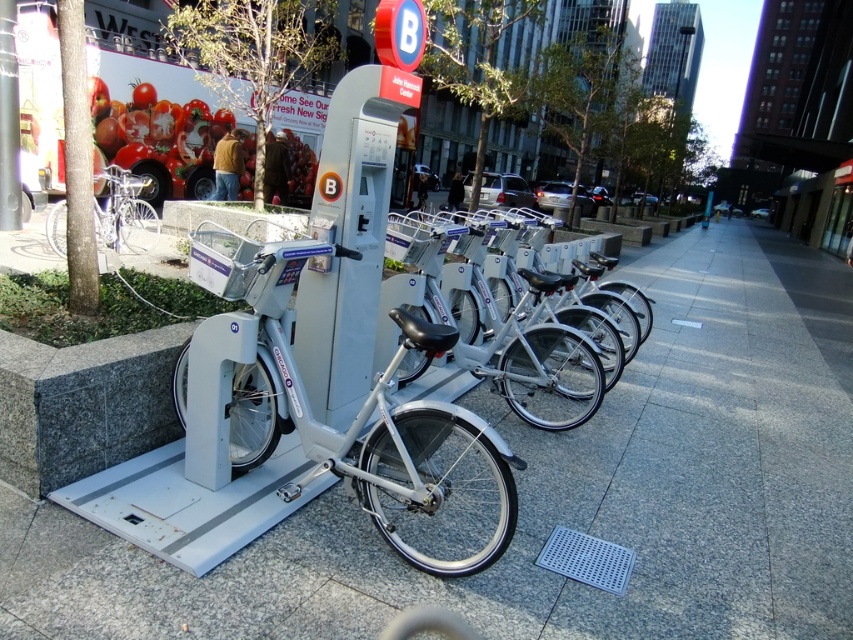
You are a delivery person who needs to park your bike at the docking station. Your bike is the same size as the silver metallic bicycle at left. The docking station has a limited space between the silver metallic pavement at center and the station itself. Can your bike fit in that space?

The silver metallic pavement at center is positioned on the right side of the silver metallic bicycle at left, meaning there is enough space between them for the bike to fit as long as it matches the bicycle at left in size.

You are a delivery person who needs to place a small package on the silver metallic pavement at center. The package is 1.2 meters wide. Can you fit the package on the pavement without overlapping the silver metallic bicycle at left?

The silver metallic pavement at center might be wider than silver metallic bicycle at left, so it is possible that the pavement can accommodate the 1.2 meter wide package without overlapping the bicycle. However, without exact measurements, this is uncertain.

You are standing on the sidewalk looking at the docking station with the white bicycles. There are two points marked on the scene. Which point is closer to you, point at (767, 307) or point at (93, 212)?

Point at (93, 212) is closer to you because the description states that point at (767, 307) is further to the viewer than point at (93, 212).